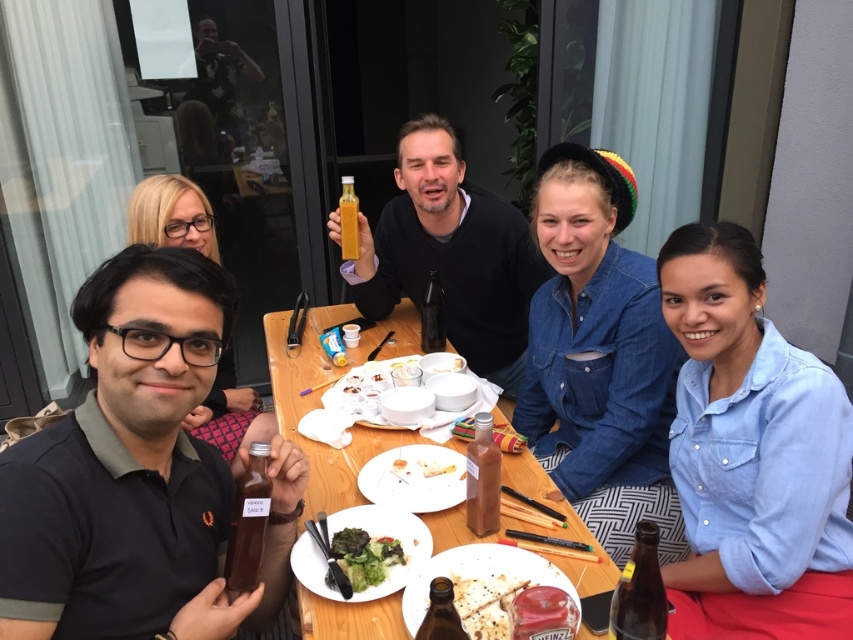
Question: Among these objects, which one is farthest from the camera?

Choices:
 (A) translucent glass bottle at lower left
 (B) brown crispy bread at lower center
 (C) white paper napkin at center

Answer: (C)

Question: Which of the following is the farthest from the observer?

Choices:
 (A) translucent glass bottle at lower left
 (B) translucent glass bottle at center

Answer: (B)

Question: Does white matte bowls at center have a larger size compared to brown crispy bread at lower center?

Choices:
 (A) yes
 (B) no

Answer: (A)

Question: Which point is closer to the camera?

Choices:
 (A) (428, 460)
 (B) (210, 426)

Answer: (A)

Question: Does blue denim shirt at center have a larger size compared to white crumbly bread at center?

Choices:
 (A) no
 (B) yes

Answer: (B)

Question: Where is translucent glass bottle at lower left located in relation to brown crispy bread at lower center in the image?

Choices:
 (A) above
 (B) below

Answer: (A)